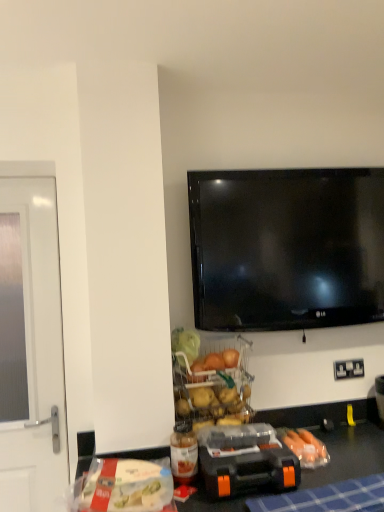
What do you see at coordinates (184, 453) in the screenshot? This screenshot has height=512, width=384. I see `translucent plastic bottle at lower center` at bounding box center [184, 453].

The image size is (384, 512). Identify the location of black plastic toolbox at lower center. pyautogui.click(x=245, y=460).

Describe the element at coordinates (36, 354) in the screenshot. I see `clear glass screen door at left` at that location.

The height and width of the screenshot is (512, 384). Find the location of `blue checkered tablecloth at lower center`. blue checkered tablecloth at lower center is located at coordinates (327, 498).

From the image's perspective, is translucent plastic bottle at lower center beneath blue checkered tablecloth at lower center?

No, from the image's perspective, translucent plastic bottle at lower center is not beneath blue checkered tablecloth at lower center.

Is point (194, 458) positioned in front of point (266, 511)?

No, it is not.

Identify the location of bottle that is on the left side of blue checkered tablecloth at lower center. (184, 453).

Does translucent plastic bottle at lower center have a smaller size compared to blue checkered tablecloth at lower center?

Yes.

Considering the positions of points (335, 375) and (113, 464), is point (335, 375) farther from camera compared to point (113, 464)?

Yes, it is behind point (113, 464).

Find the location of a particular element. electric outlet above the white plastic bag at lower left (from the image's perspective) is located at coordinates (348, 369).

Is white plastic electric outlet at lower right looking in the opposite direction of white plastic bag at lower left?

No.

Does white plastic electric outlet at lower right have a lesser width compared to white plastic bag at lower left?

Indeed, white plastic electric outlet at lower right has a lesser width compared to white plastic bag at lower left.

In the image, is white plastic bag at lower left on the left side or the right side of clear glass screen door at left?

From the image, it's evident that white plastic bag at lower left is to the right of clear glass screen door at left.

Based on the photo, is white plastic bag at lower left inside or outside of clear glass screen door at left?

white plastic bag at lower left is located beyond the bounds of clear glass screen door at left.

Identify the location of food located underneath the clear glass screen door at left (from a real-world perspective). The image size is (384, 512). 125,486.

Is white plastic bag at lower left taller or shorter than clear glass screen door at left?

In the image, white plastic bag at lower left appears to be shorter than clear glass screen door at left.

Does clear glass screen door at left have a greater height compared to black plastic toolbox at lower center?

Yes.

Is clear glass screen door at left spatially inside black plastic toolbox at lower center, or outside of it?

The correct answer is: outside.

From a real-world perspective, which is physically above, clear glass screen door at left or black plastic toolbox at lower center?

In real-world perspective, clear glass screen door at left is above.

Looking at their sizes, would you say clear glass screen door at left is wider or thinner than black plastic toolbox at lower center?

In the image, clear glass screen door at left appears to be more narrow than black plastic toolbox at lower center.

From a real-world perspective, does white plastic electric outlet at lower right stand above blue checkered tablecloth at lower center?

Yes.

Between white plastic electric outlet at lower right and blue checkered tablecloth at lower center, which one has smaller size?

white plastic electric outlet at lower right is smaller.

Considering the sizes of white plastic electric outlet at lower right and blue checkered tablecloth at lower center in the image, is white plastic electric outlet at lower right taller or shorter than blue checkered tablecloth at lower center?

white plastic electric outlet at lower right is taller than blue checkered tablecloth at lower center.

Is white plastic electric outlet at lower right surrounding blue checkered tablecloth at lower center?

That's incorrect, blue checkered tablecloth at lower center is not inside white plastic electric outlet at lower right.

In the scene shown: Is white plastic bag at lower left at the right side of blue checkered tablecloth at lower center?

No, white plastic bag at lower left is not to the right of blue checkered tablecloth at lower center.

Is the position of white plastic bag at lower left less distant than that of blue checkered tablecloth at lower center?

That is True.

From the image's perspective, which one is positioned lower, white plastic bag at lower left or blue checkered tablecloth at lower center?

white plastic bag at lower left appears lower in the image.

Is white plastic bag at lower left wider or thinner than blue checkered tablecloth at lower center?

white plastic bag at lower left is wider than blue checkered tablecloth at lower center.

Is black plastic toolbox at lower center shorter than blue checkered tablecloth at lower center?

No, black plastic toolbox at lower center is not shorter than blue checkered tablecloth at lower center.

From the image's perspective, which object appears higher, black plastic toolbox at lower center or blue checkered tablecloth at lower center?

black plastic toolbox at lower center appears higher in the image.

This screenshot has width=384, height=512. Identify the location of appliance above the blue checkered tablecloth at lower center (from a real-world perspective). (245, 460).

Which point is more distant from viewer, [274,438] or [325,499]?

Positioned behind is point [274,438].

Locate an element on the screen. The width and height of the screenshot is (384, 512). bottle behind the blue checkered tablecloth at lower center is located at coordinates (184, 453).

Image resolution: width=384 pixels, height=512 pixels. I want to click on electric outlet above the white plastic bag at lower left (from a real-world perspective), so click(x=348, y=369).

Based on their spatial positions, is white plastic electric outlet at lower right or blue checkered tablecloth at lower center further from black plastic toolbox at lower center?

white plastic electric outlet at lower right is positioned further to the anchor black plastic toolbox at lower center.

Which object lies further to the anchor point white plastic electric outlet at lower right, translucent plastic bottle at lower center or black plastic toolbox at lower center?

The object further to white plastic electric outlet at lower right is translucent plastic bottle at lower center.

Considering their positions, is white plastic bag at lower left positioned further to black plastic toolbox at lower center than clear glass screen door at left?

clear glass screen door at left is positioned further to the anchor black plastic toolbox at lower center.

Estimate the real-world distances between objects in this image. Which object is closer to white plastic bag at lower left, clear glass screen door at left or translucent plastic bottle at lower center?

translucent plastic bottle at lower center is positioned closer to the anchor white plastic bag at lower left.

Considering their positions, is black plastic toolbox at lower center positioned further to translucent plastic bottle at lower center than clear glass screen door at left?

clear glass screen door at left.

Based on their spatial positions, is white plastic electric outlet at lower right or white plastic bag at lower left further from black plastic toolbox at lower center?

white plastic electric outlet at lower right is further to black plastic toolbox at lower center.

Which object lies nearer to the anchor point clear glass screen door at left, black plastic toolbox at lower center or blue checkered tablecloth at lower center?

The object closer to clear glass screen door at left is black plastic toolbox at lower center.

Which object lies further to the anchor point white plastic electric outlet at lower right, white plastic bag at lower left or clear glass screen door at left?

Among the two, clear glass screen door at left is located further to white plastic electric outlet at lower right.

The height and width of the screenshot is (512, 384). What are the coordinates of `appliance between white plastic bag at lower left and blue checkered tablecloth at lower center from left to right` in the screenshot? It's located at (245, 460).

At what (x,y) coordinates should I click in order to perform the action: click on bottle situated between white plastic bag at lower left and blue checkered tablecloth at lower center from left to right. Please return your answer as a coordinate pair (x, y). Looking at the image, I should click on (184, 453).

The image size is (384, 512). What are the coordinates of `appliance situated between white plastic bag at lower left and white plastic electric outlet at lower right from left to right` in the screenshot? It's located at (245, 460).

Identify the location of food between clear glass screen door at left and blue checkered tablecloth at lower center from left to right. Image resolution: width=384 pixels, height=512 pixels. (125, 486).